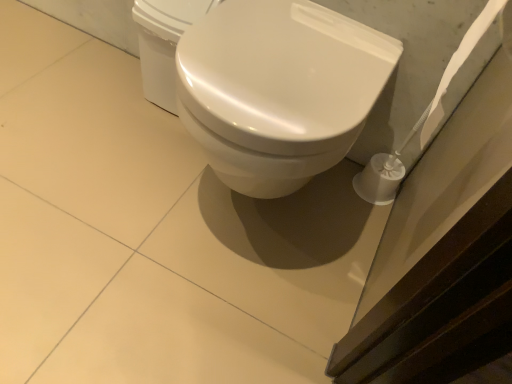
Find the location of `free space between white glossy toilet at center and white glossy toilet at upper center`. free space between white glossy toilet at center and white glossy toilet at upper center is located at coordinates (148, 149).